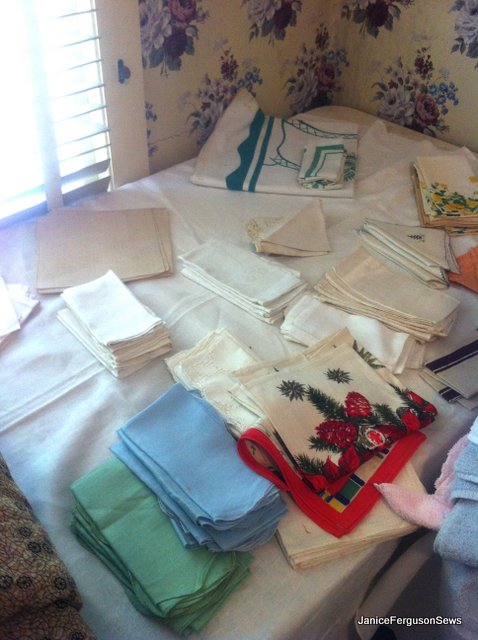
I want to click on wallpaper, so click(x=434, y=15).